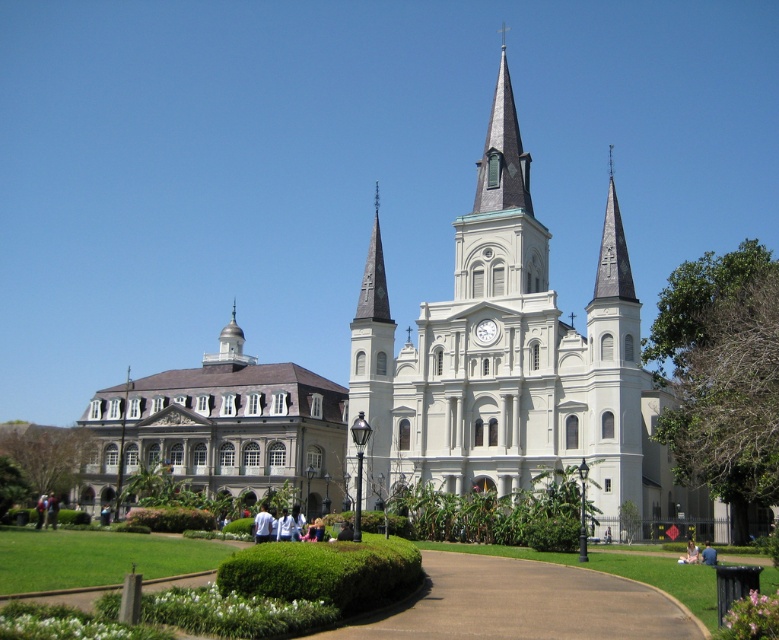
Question: Which of these objects is positioned farthest from the white stone church at center?

Choices:
 (A) white stone clock at center
 (B) white stone building at left
 (C) blue denim jeans at lower center

Answer: (C)

Question: Which of the following is the closest to the observer?

Choices:
 (A) tap(492, 323)
 (B) tap(245, 432)

Answer: (A)

Question: Does light brown hair at lower right appear on the right side of blue denim jeans at lower center?

Choices:
 (A) yes
 (B) no

Answer: (B)

Question: Which of the following is the farthest from the observer?

Choices:
 (A) (425, 586)
 (B) (714, 550)
 (C) (686, 554)

Answer: (C)

Question: Considering the relative positions of brown asphalt path at center and white stone clock at center in the image provided, where is brown asphalt path at center located with respect to white stone clock at center?

Choices:
 (A) above
 (B) below

Answer: (B)

Question: Does brown asphalt path at center have a smaller size compared to blue denim jeans at lower center?

Choices:
 (A) yes
 (B) no

Answer: (B)